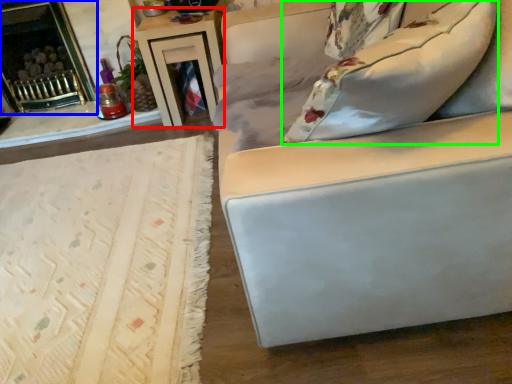
Question: Based on their relative distances, which object is nearer to table (highlighted by a red box)? Choose from fireplace (highlighted by a blue box) and pillow (highlighted by a green box).

Choices:
 (A) fireplace
 (B) pillow

Answer: (A)